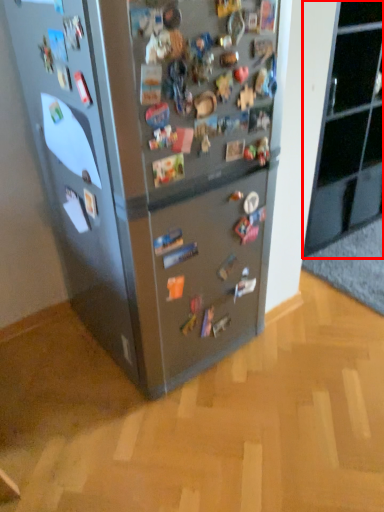
Question: In this image, where is cabinetry (annotated by the red box) located relative to refrigerator?

Choices:
 (A) right
 (B) left

Answer: (A)